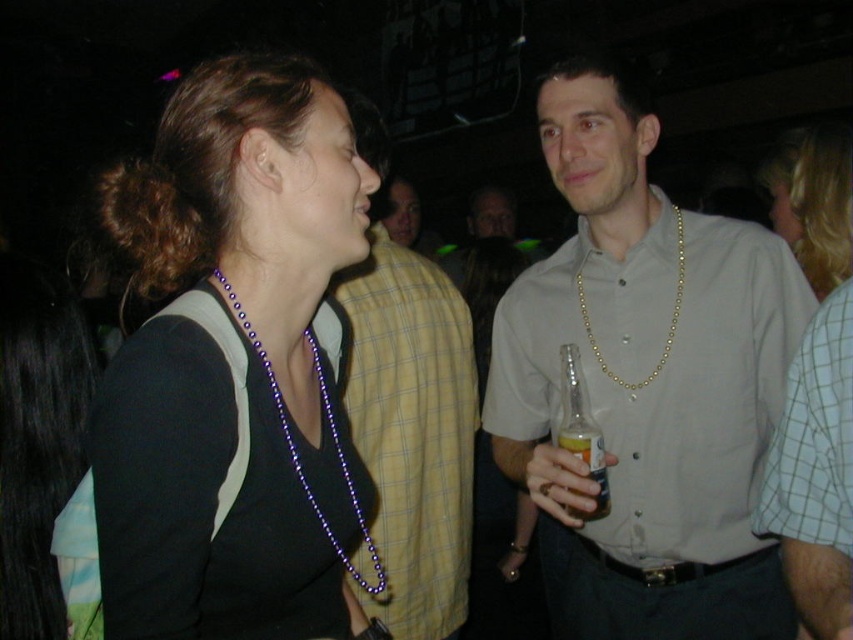
Question: Which point is farther to the camera?

Choices:
 (A) gold chain necklace at center
 (B) blonde hair at upper right
 (C) translucent plastic bottle at center
 (D) clear glass bottle at right

Answer: (B)

Question: Observing the image, what is the correct spatial positioning of gold chain necklace at center in reference to purple beaded necklace at center?

Choices:
 (A) right
 (B) left

Answer: (A)

Question: Is gold chain necklace at center positioned behind blonde hair at upper right?

Choices:
 (A) yes
 (B) no

Answer: (B)

Question: Which point is farther to the camera?

Choices:
 (A) (392, 250)
 (B) (572, 452)

Answer: (A)

Question: Considering the real-world distances, which object is farthest from the gold beaded necklace at center?

Choices:
 (A) white checkered shirt at right
 (B) translucent plastic bottle at center
 (C) purple beaded necklace at upper left
 (D) gold chain necklace at center

Answer: (C)

Question: Is yellow plaid shirt at center wider than clear glass bottle at right?

Choices:
 (A) yes
 (B) no

Answer: (A)